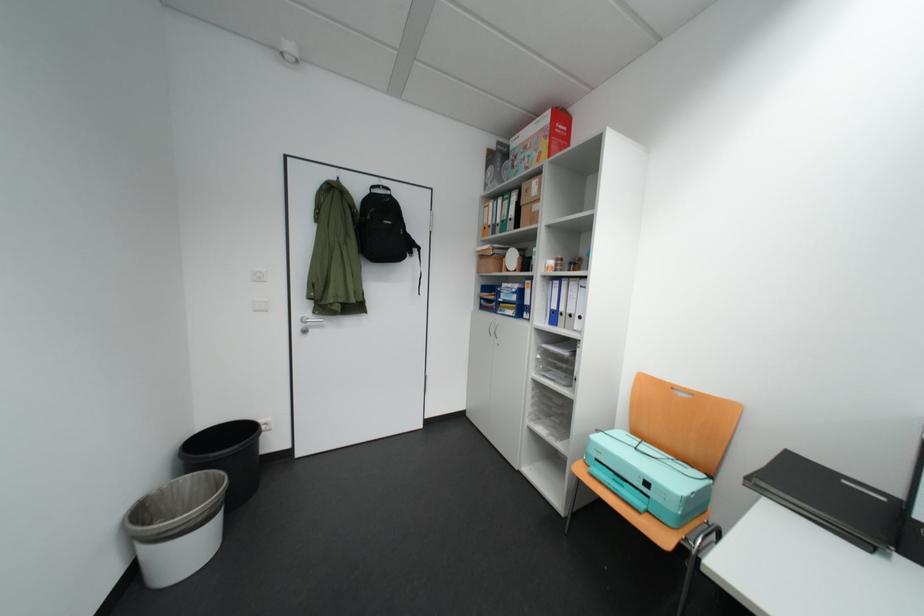
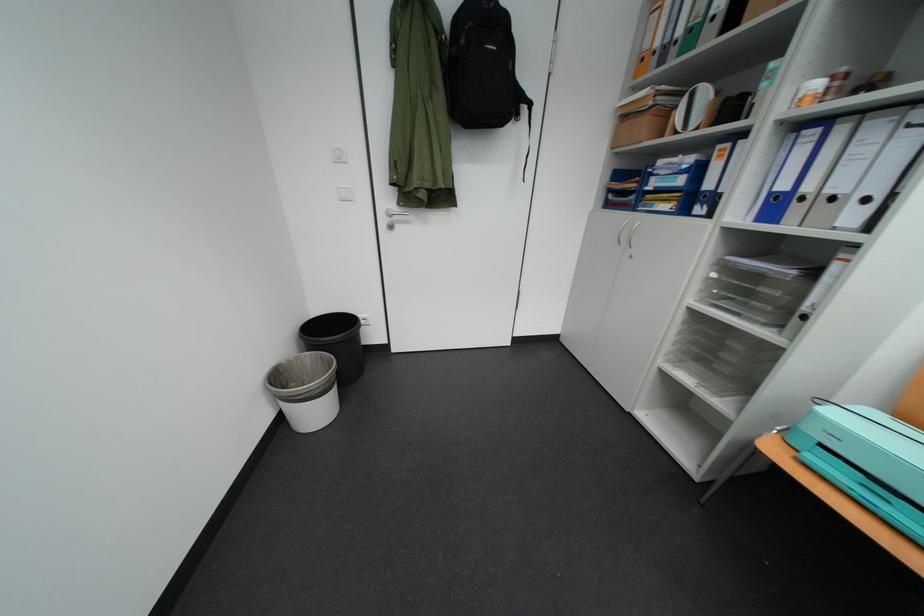
Find the pixel in the second image that matches point 516,257 in the first image.

(687, 108)